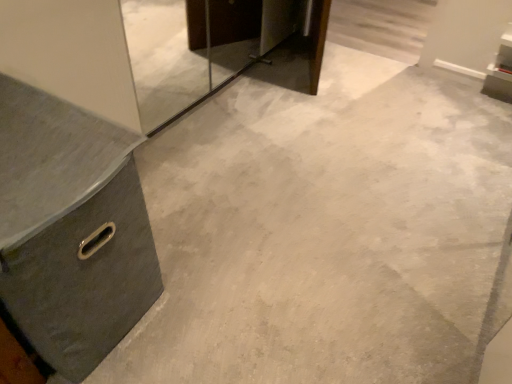
Identify the location of unoccupied region to the right of matte gray fabric chest of drawers at left. The width and height of the screenshot is (512, 384). (211, 282).